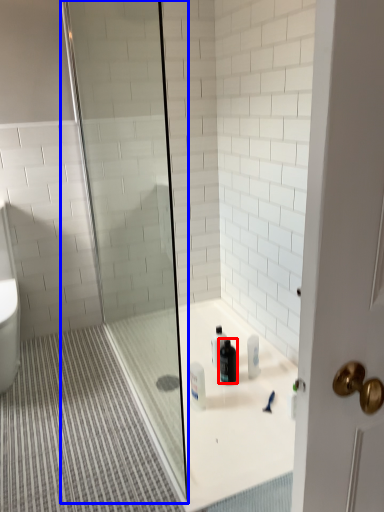
Question: Which object is closer to the camera taking this photo, cleaning product (highlighted by a red box) or shower door (highlighted by a blue box)?

Choices:
 (A) cleaning product
 (B) shower door

Answer: (B)